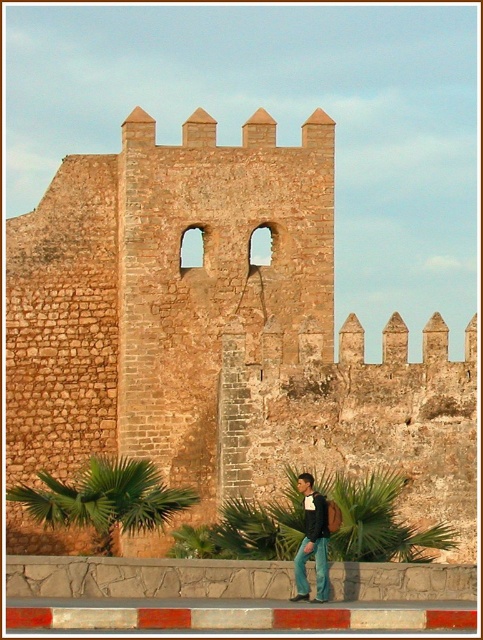
Question: Can you confirm if brown stone wall at center is smaller than green leafy palm at lower left?

Choices:
 (A) no
 (B) yes

Answer: (A)

Question: Which point is farther from the camera taking this photo?

Choices:
 (A) (221, 291)
 (B) (312, 502)
 (C) (34, 490)

Answer: (A)

Question: Is jeans at lower right smaller than jeans at lower center?

Choices:
 (A) yes
 (B) no

Answer: (A)

Question: Which is nearer to the jeans at lower right?

Choices:
 (A) green leafy palm at lower left
 (B) jeans at lower center
 (C) brown stone wall at center

Answer: (B)

Question: Among these points, which one is nearest to the camera?

Choices:
 (A) (309, 509)
 (B) (39, 496)

Answer: (A)

Question: Can you confirm if green leafy palm at lower left is positioned to the left of jeans at lower right?

Choices:
 (A) yes
 (B) no

Answer: (A)